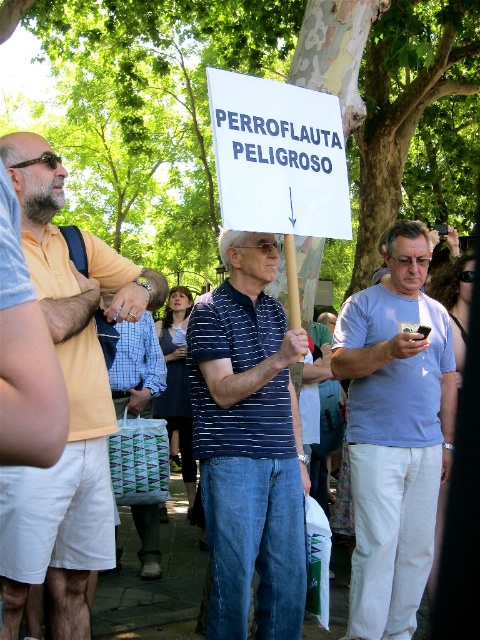
You are a photographer trying to capture a clear shot of both the matte yellow shirt at left and the blue striped shirt at center. Since you want both subjects in focus, which one should you adjust your camera focus on first?

The matte yellow shirt at left is closer to the viewer than the blue striped shirt at center. To ensure both are in focus, you should set the focus on the matte yellow shirt at left first, as it is closer, and the depth of field will naturally extend to the farther subject.

Based on the coordinates provided, which object is located at point (69, 404)?

The point (69, 404) marks the location of the matte yellow shirt at left.

You are a photographer taking a picture of the scene. You notice two points marked in the image. Which of these points, point [208,474] or point [382,625], is closer to your camera lens?

Point [208,474] is closer to the camera than point [382,625].